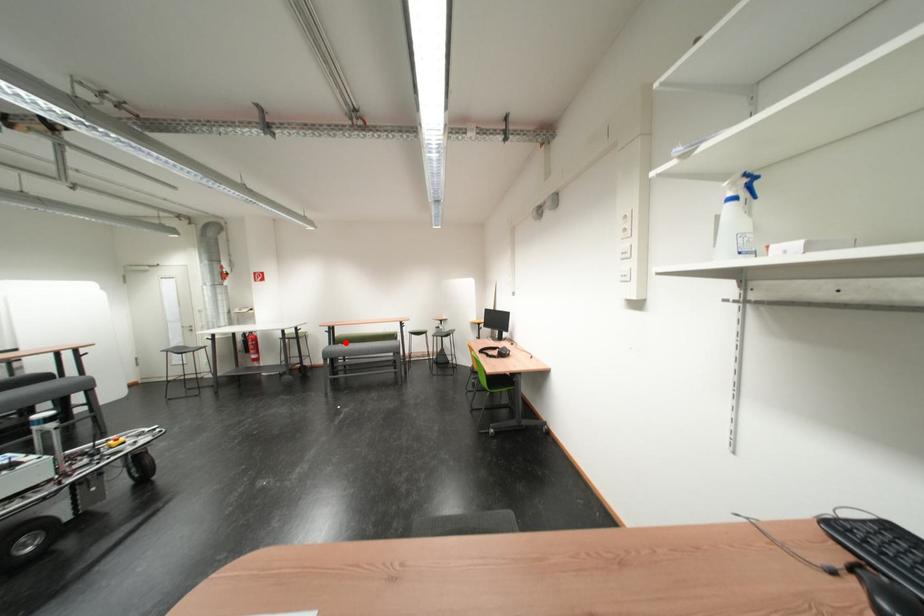
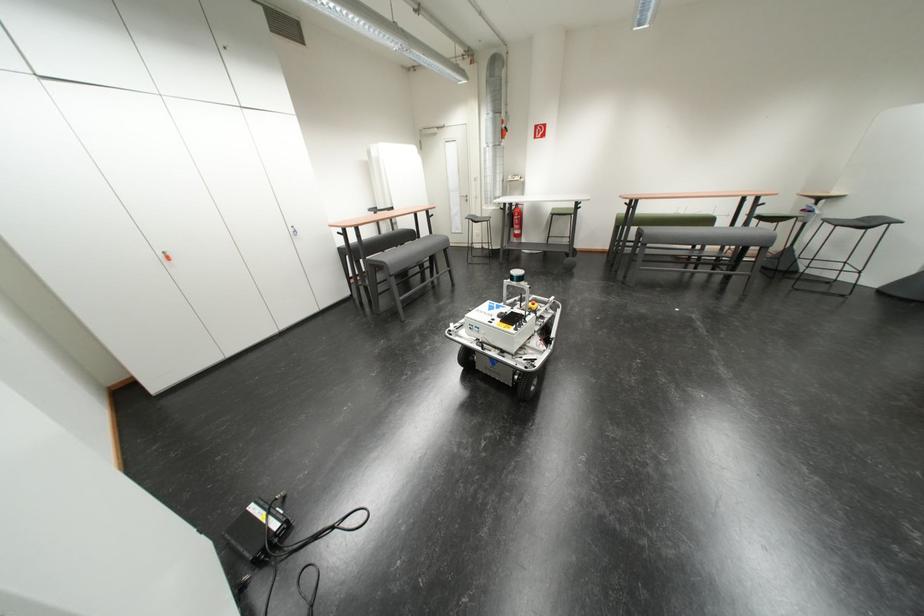
Question: I am providing you with two images of the same scene from different viewpoints. Image1 has a red point marked. In image2, the corresponding 3D location appears at what relative position? Reply with the corresponding letter.

Choices:
 (A) Closer
 (B) Farther

Answer: (A)